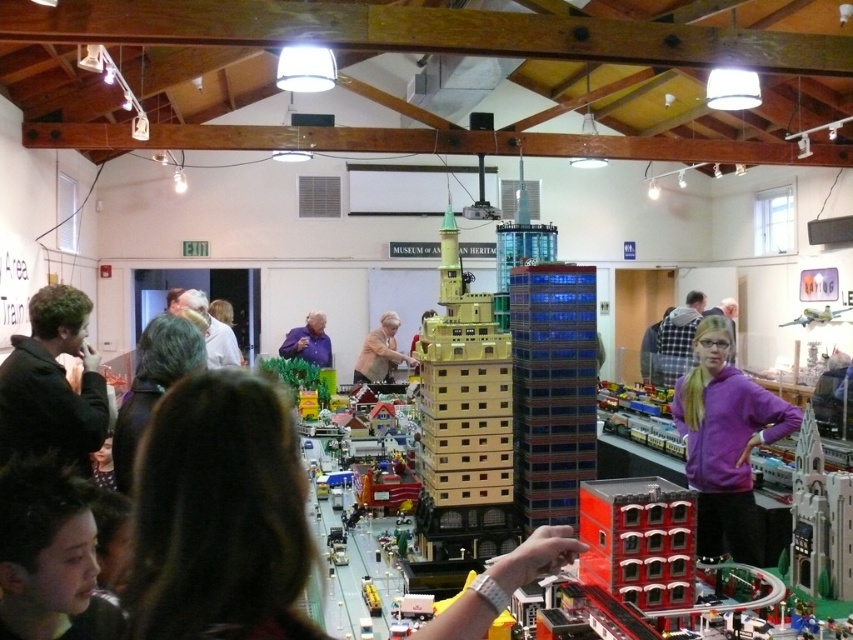
Question: Which is farther from the matte gold tower at center?

Choices:
 (A) brown hair at center
 (B) black matte jacket at left
 (C) yellow matte building at center
 (D) purple fleece at center

Answer: (A)

Question: Among these points, which one is nearest to the camera?

Choices:
 (A) (215, 353)
 (B) (753, 556)
 (C) (439, 371)

Answer: (C)

Question: Is smooth red building at center below matte gold tower at center?

Choices:
 (A) yes
 (B) no

Answer: (A)

Question: Can you confirm if dark brown hair at center is bigger than purple matte shirt at center?

Choices:
 (A) yes
 (B) no

Answer: (B)

Question: Based on their relative distances, which object is nearer to the purple matte shirt at center?

Choices:
 (A) black matte jacket at left
 (B) dark brown hair at center
 (C) purple fleece at center

Answer: (C)

Question: Is brown hair at center to the left of smooth red building at center from the viewer's perspective?

Choices:
 (A) yes
 (B) no

Answer: (A)